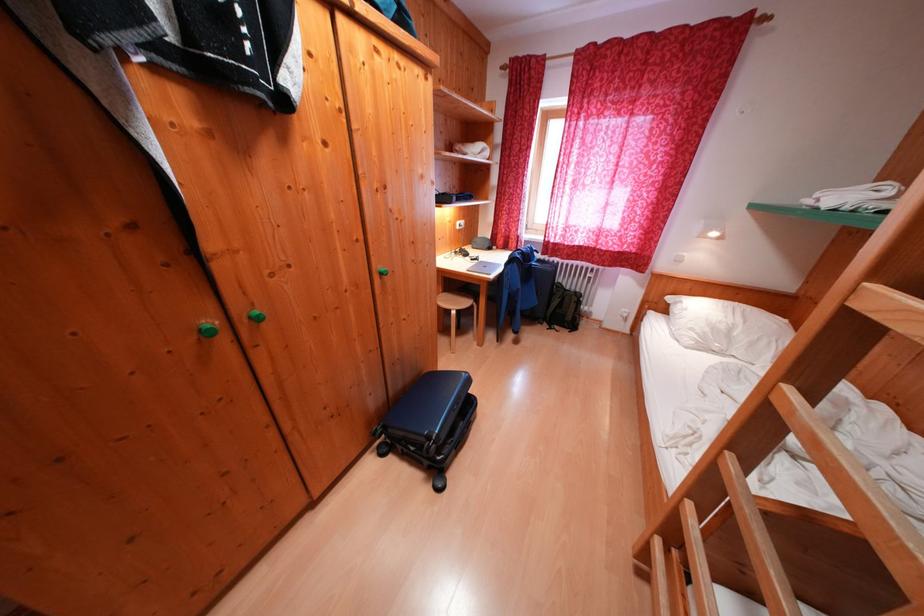
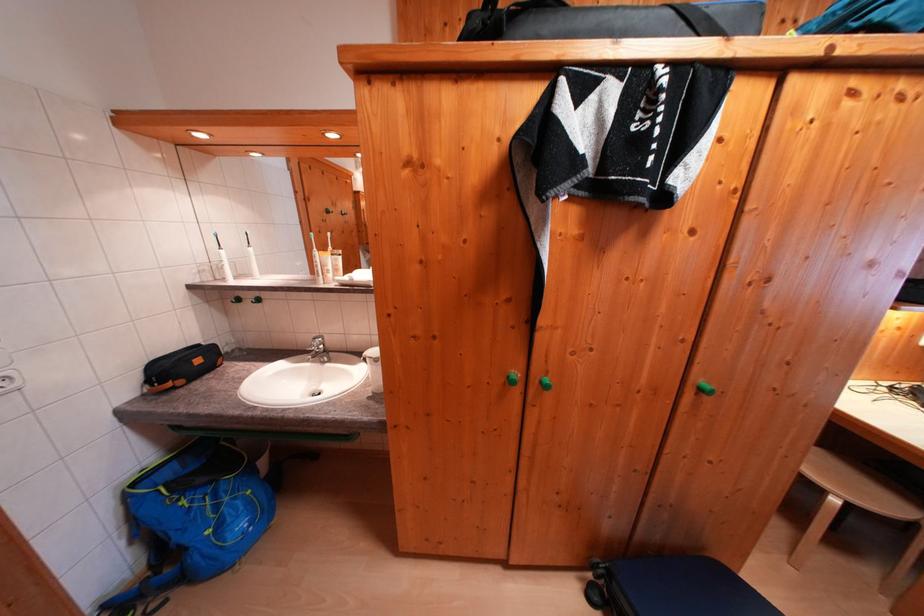
Locate, in the second image, the point that corresponds to the point at 390,278 in the first image.

(709, 394)